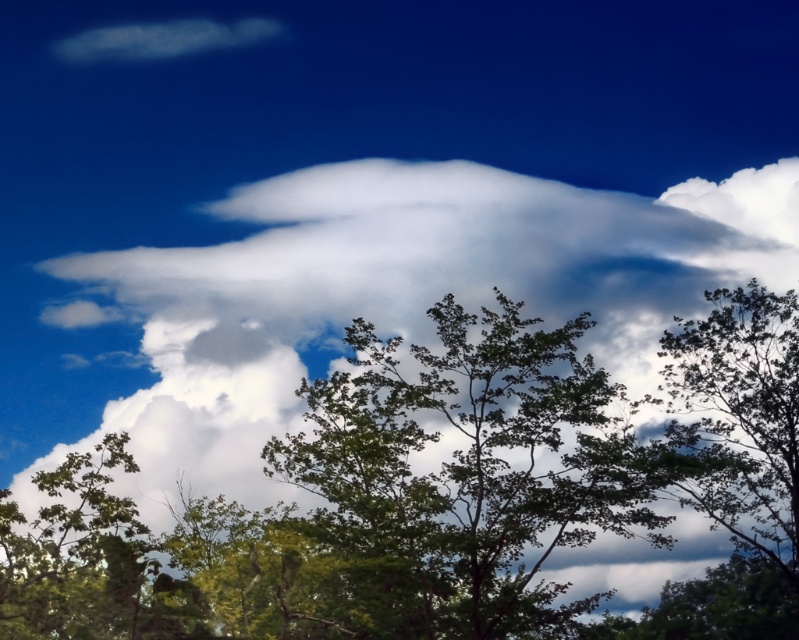
You are an astronomer observing the sky from the green leafy tree at center. Can you see the white fluffy cloud at upper center clearly?

The green leafy tree at center is behind the white fluffy cloud at upper center, so the astronomer can see the white fluffy cloud at upper center clearly without obstruction.

You are a photographer planning to capture the white fluffy cloud at upper center and the green leafy tree at center in a single frame. Based on their sizes, which object would appear more prominent in the photo?

The white fluffy cloud at upper center would appear more prominent in the photo because its width is larger than the green leafy tree at center.

You are a bird flying at coordinates 0.6, 0.6 in the image. You want to land on the green leafy tree at center. In which direction should you move to reach it?

The green leafy tree at center is located at point (470, 474). Since your current position is at (479, 384), you should move northeast to reach it.